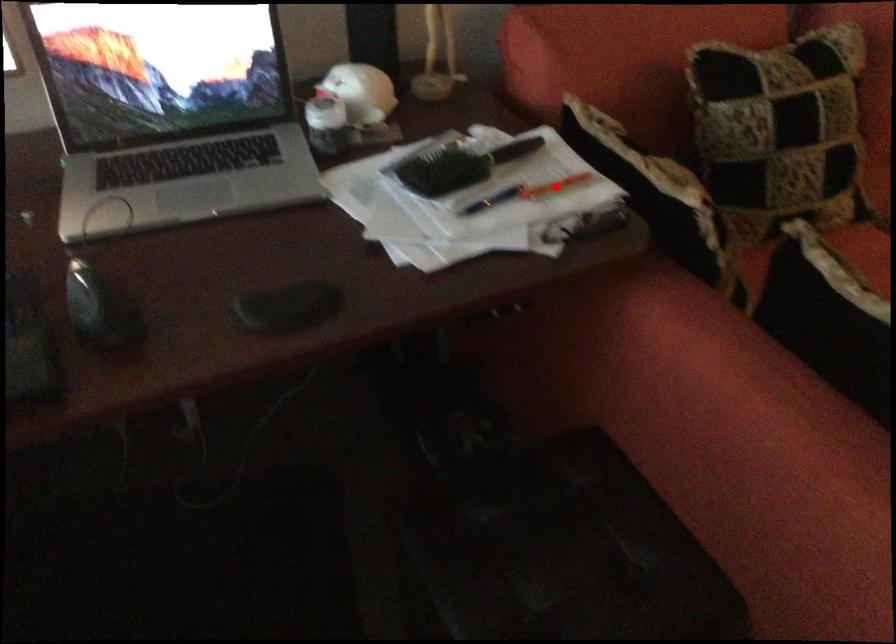
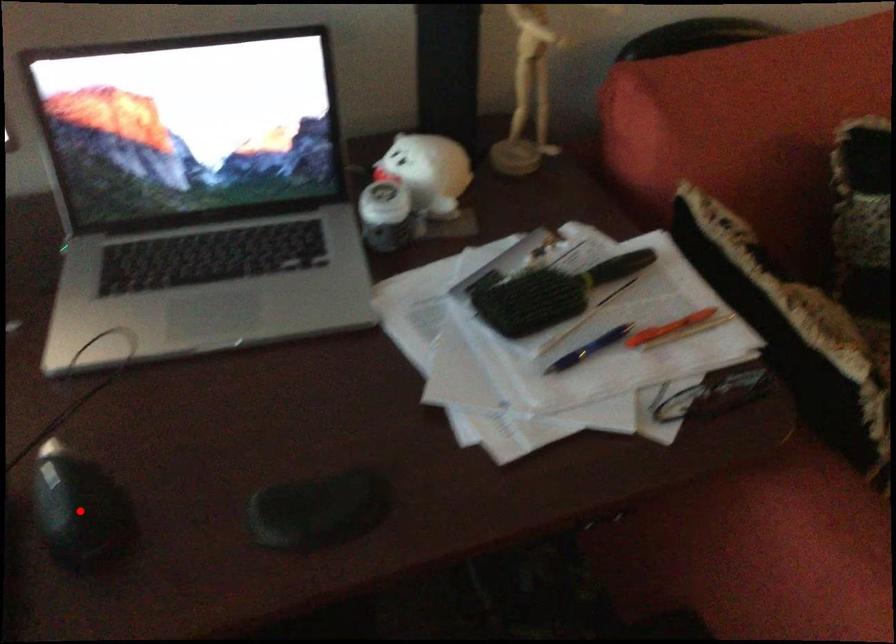
I am providing you with two images of the same scene from different viewpoints. A red point is marked on the first image and another point is marked on the second image. Does the point marked in image1 correspond to the same location as the one in image2?

No